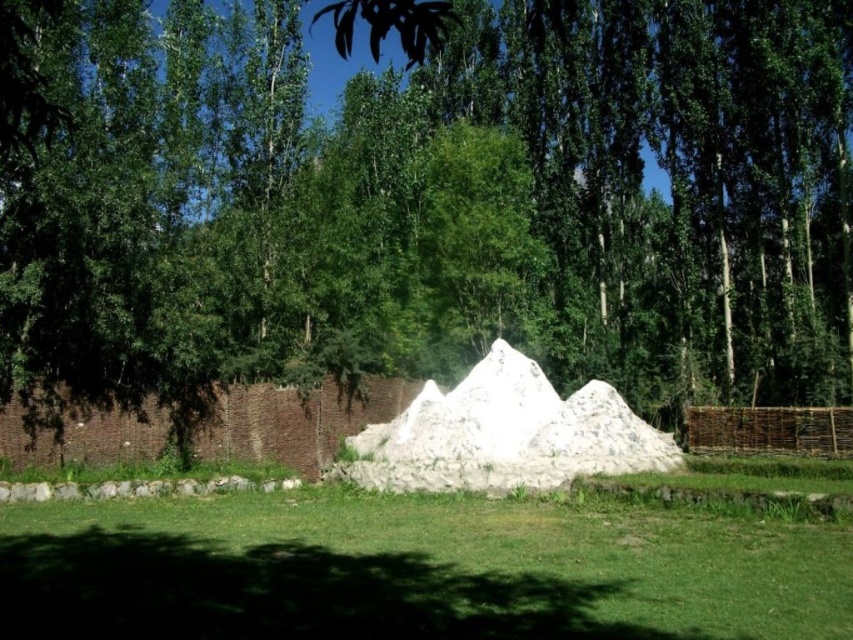
Is green leafy tree at center shorter than white sand pyramid at center?

Incorrect, green leafy tree at center's height does not fall short of white sand pyramid at center's.

The image size is (853, 640). In order to click on green leafy tree at center in this screenshot , I will do `click(444, 204)`.

You are a GUI agent. You are given a task and a screenshot of the screen. Output one action in this format:
    pyautogui.click(x=<x>, y=<y>)
    Task: Click on the green leafy tree at center
    The width and height of the screenshot is (853, 640).
    Given the screenshot: What is the action you would take?
    pyautogui.click(x=444, y=204)

Between green leafy tree at center and green grass at center, which one is positioned lower?

green grass at center

Can you confirm if green leafy tree at center is bigger than green grass at center?

Indeed, green leafy tree at center has a larger size compared to green grass at center.

Is point (828, 122) closer to camera compared to point (352, 545)?

No.

This screenshot has width=853, height=640. What are the coordinates of `green leafy tree at center` in the screenshot? It's located at (444, 204).

Is point (721, 598) in front of point (477, 394)?

Yes.

Between green grass at center and white sand pyramid at center, which one has less height?

green grass at center

Describe the element at coordinates (413, 570) in the screenshot. I see `green grass at center` at that location.

The width and height of the screenshot is (853, 640). What are the coordinates of `green grass at center` in the screenshot? It's located at (413, 570).